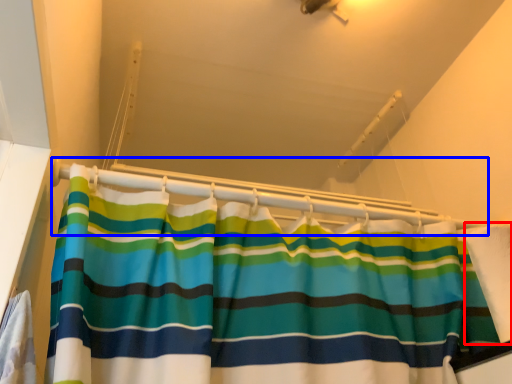
Question: Which object is further to the camera taking this photo, fabric (highlighted by a red box) or balustrade (highlighted by a blue box)?

Choices:
 (A) fabric
 (B) balustrade

Answer: (B)